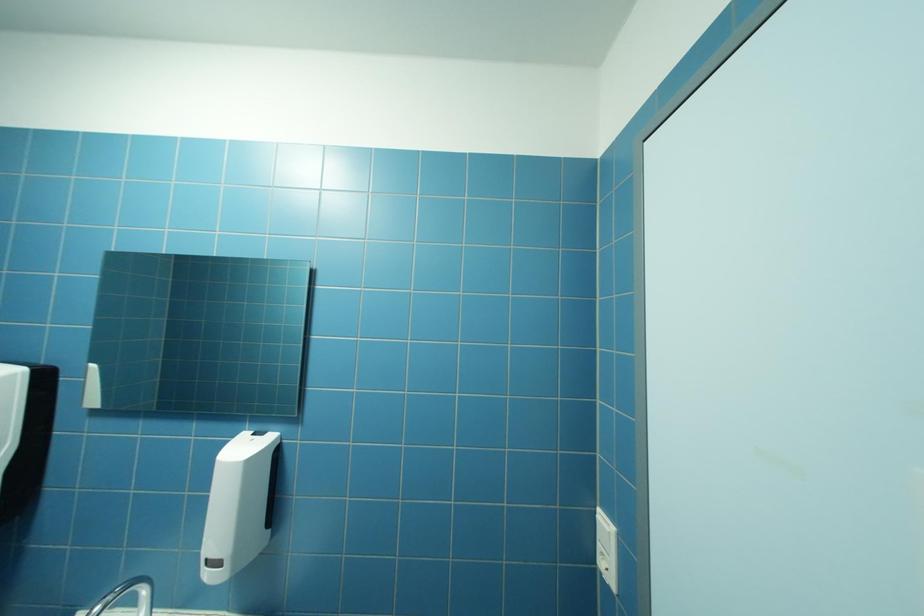
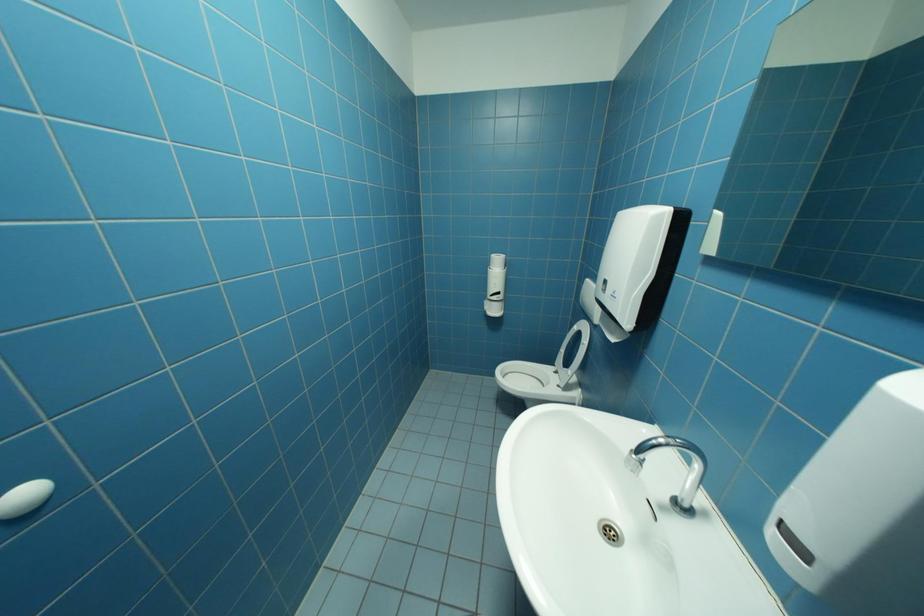
First-person continuous shooting, in which direction is the camera rotating?

The camera rotated toward left-down.